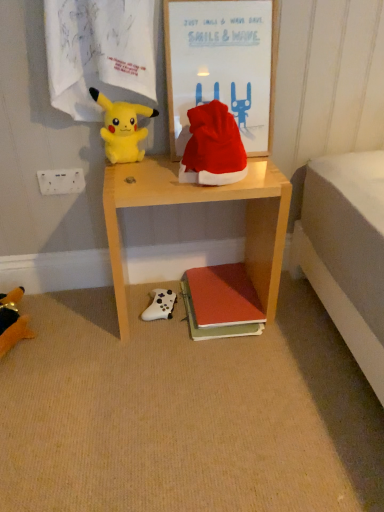
Where is `free space between soft plush toy at lower left, positioned as the first toy in left-to-right order, and matte orange book at lower center`? The image size is (384, 512). free space between soft plush toy at lower left, positioned as the first toy in left-to-right order, and matte orange book at lower center is located at coordinates (105, 330).